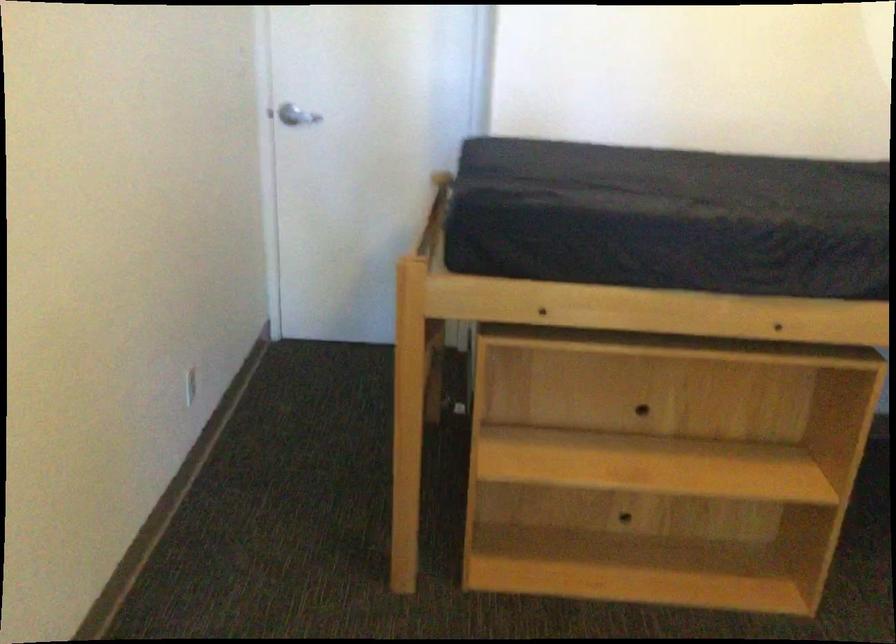
Find the location of `silver door handle`. silver door handle is located at coordinates point(287,115).